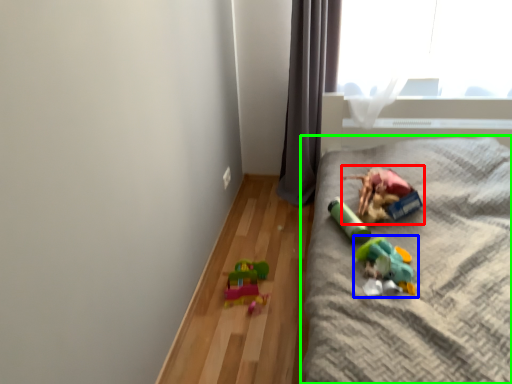
Question: Based on their relative distances, which object is nearer to toy (highlighted by a red box)? Choose from toy (highlighted by a blue box) and furniture (highlighted by a green box).

Choices:
 (A) toy
 (B) furniture

Answer: (B)